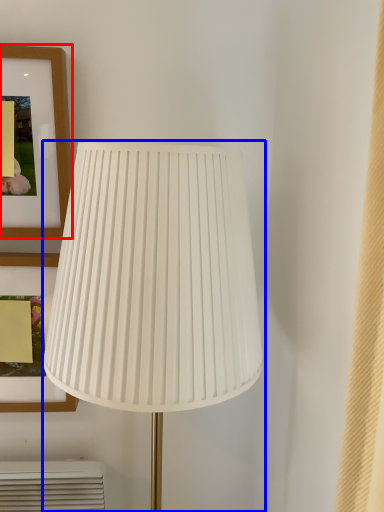
Question: Which point is further to the camera, picture frame (highlighted by a red box) or lamp (highlighted by a blue box)?

Choices:
 (A) picture frame
 (B) lamp

Answer: (A)